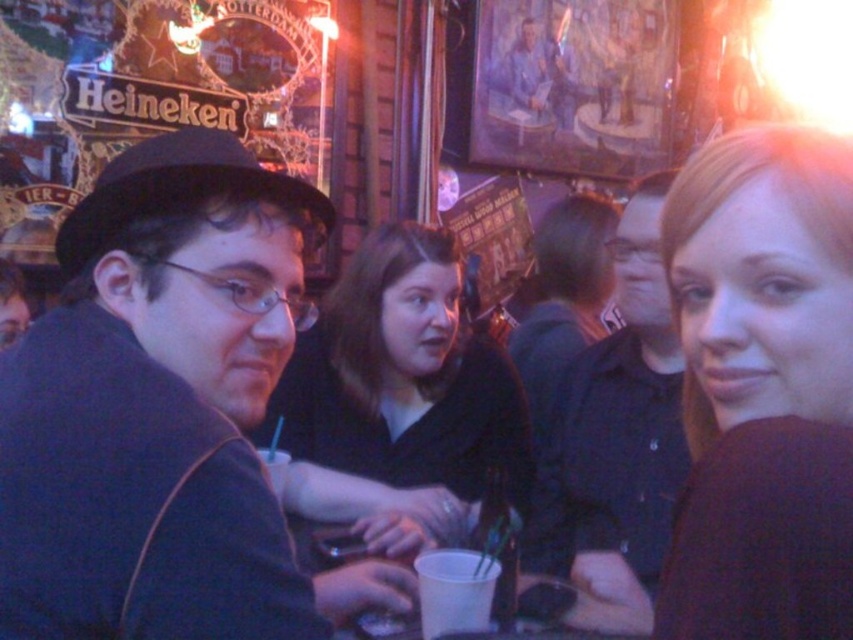
Does point (587, 436) come in front of point (498, 563)?

No, it is behind (498, 563).

Which is behind, point (619, 492) or point (454, 557)?

The point (619, 492) is more distant.

At what (x,y) coordinates should I click in order to perform the action: click on dark blue shirt at center. Please return your answer as a coordinate pair (x, y). Image resolution: width=853 pixels, height=640 pixels. Looking at the image, I should click on (619, 440).

Is the position of dark gray coat at left more distant than that of white paper cup at center?

No, it is not.

In the scene shown: Does dark gray coat at left have a larger size compared to white paper cup at center?

Yes.

Who is more distant from viewer, [77,385] or [494,560]?

The point [494,560] is behind.

This screenshot has width=853, height=640. I want to click on dark gray coat at left, so click(x=165, y=412).

Between dark gray coat at left and matte black shirt at center, which one appears on the right side from the viewer's perspective?

matte black shirt at center

In the scene shown: Is dark gray coat at left smaller than matte black shirt at center?

Yes.

Which is behind, point (39, 340) or point (405, 518)?

The point (405, 518) is behind.

At what (x,y) coordinates should I click in order to perform the action: click on dark gray coat at left. Please return your answer as a coordinate pair (x, y). Looking at the image, I should click on (165, 412).